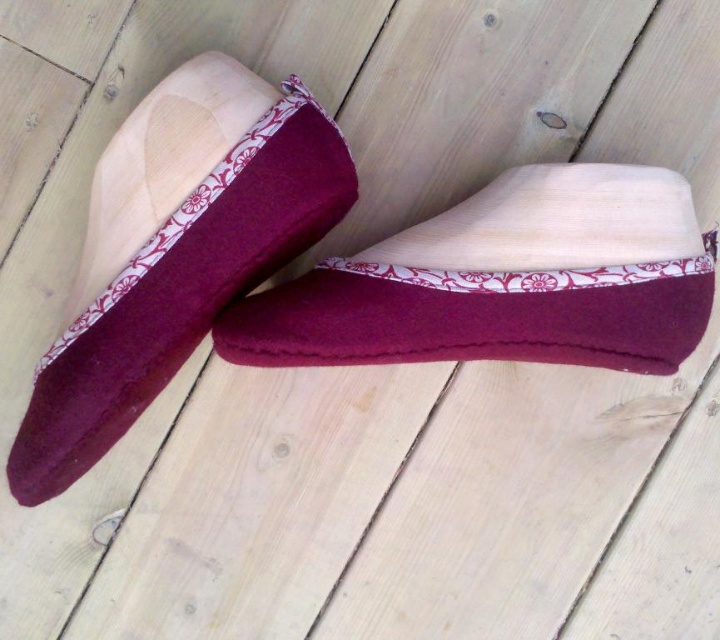
Question: Is burgundy felt slipper at center to the left of burgundy felt sock at center from the viewer's perspective?

Choices:
 (A) no
 (B) yes

Answer: (A)

Question: Is burgundy felt slipper at center smaller than burgundy felt sock at center?

Choices:
 (A) no
 (B) yes

Answer: (B)

Question: Can you confirm if burgundy felt slipper at center is thinner than burgundy felt sock at center?

Choices:
 (A) no
 (B) yes

Answer: (A)

Question: Which point is farther from the camera taking this photo?

Choices:
 (A) (302, 193)
 (B) (462, 332)

Answer: (B)

Question: Which point is closer to the camera taking this photo?

Choices:
 (A) (338, 292)
 (B) (194, 289)

Answer: (B)